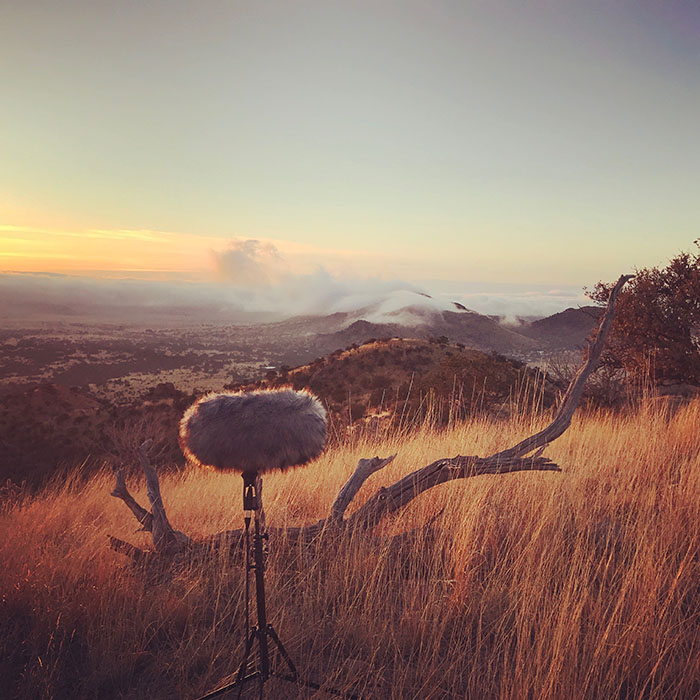
At what (x,y) coordinates should I click in order to perform the action: click on cord. Please return your answer as a coordinate pair (x, y). Looking at the image, I should click on (246, 570), (243, 668).